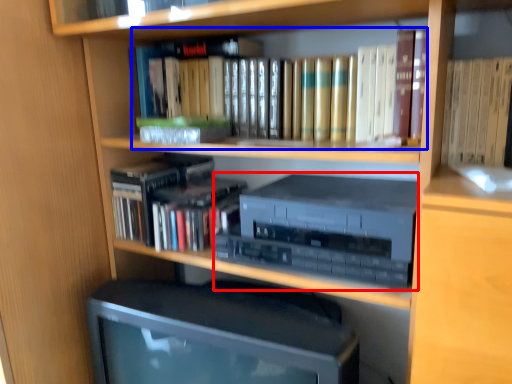
Question: Among these objects, which one is nearest to the camera, stereo (highlighted by a red box) or book (highlighted by a blue box)?

Choices:
 (A) stereo
 (B) book

Answer: (A)